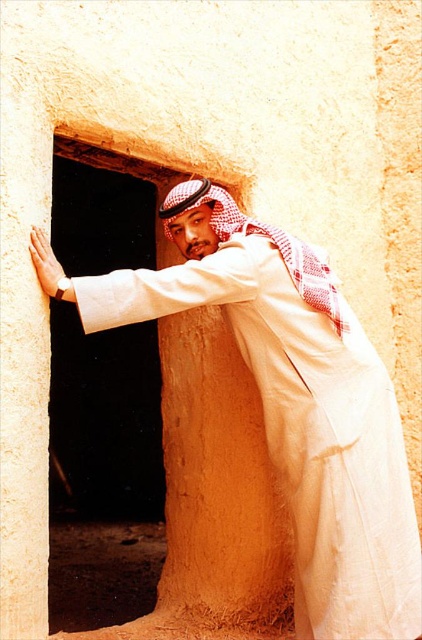
Consider the image. Is white cotton robe at center positioned behind matte beige stone wall at center?

That is False.

Who is more forward, (299, 312) or (246, 436)?

Point (299, 312)

The width and height of the screenshot is (422, 640). Identify the location of white cotton robe at center. (289, 401).